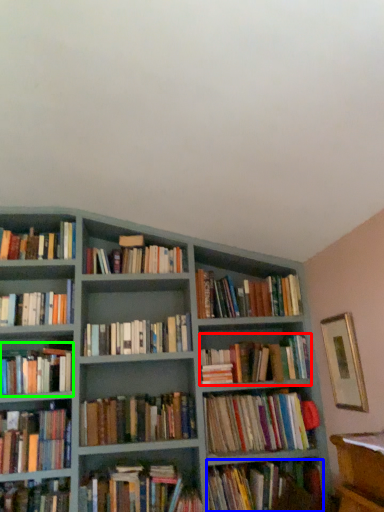
Question: Which is nearer to the book (highlighted by a red box)? book (highlighted by a blue box) or book (highlighted by a green box).

Choices:
 (A) book
 (B) book

Answer: (A)